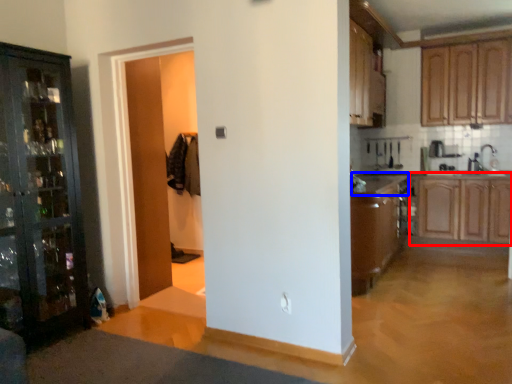
Question: Which of the following is the farthest to the observer, cabinetry (highlighted by a red box) or counter top (highlighted by a blue box)?

Choices:
 (A) cabinetry
 (B) counter top

Answer: (A)